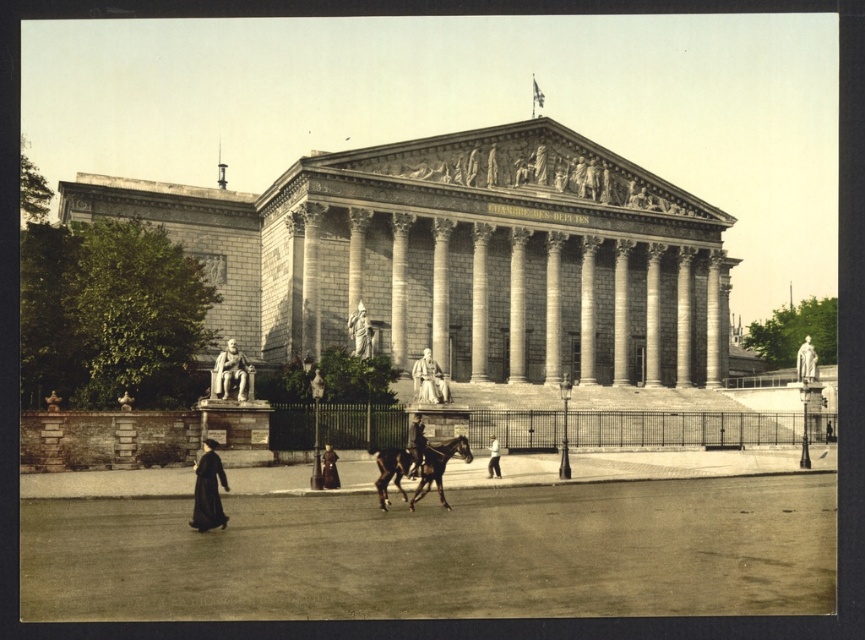
Which of these two, brown glossy horse at center or stone statue at left, stands shorter?

brown glossy horse at center

Who is higher up, brown glossy horse at center or stone statue at left?

stone statue at left is higher up.

Is point (407, 452) farther from camera compared to point (232, 378)?

That is False.

This screenshot has width=865, height=640. I want to click on brown glossy horse at center, so (x=417, y=467).

Does smooth stone statue at center have a smaller size compared to light beige fabric coat at center?

Yes.

Is smooth stone statue at center shorter than light beige fabric coat at center?

Yes.

This screenshot has width=865, height=640. What do you see at coordinates (428, 380) in the screenshot?
I see `smooth stone statue at center` at bounding box center [428, 380].

The width and height of the screenshot is (865, 640). I want to click on smooth stone statue at center, so click(x=428, y=380).

Does gray stone column at center come in front of smooth leather jacket at center?

No, gray stone column at center is further to the viewer.

The height and width of the screenshot is (640, 865). Describe the element at coordinates (587, 308) in the screenshot. I see `gray stone column at center` at that location.

Between point (590, 282) and point (407, 472), which one is positioned behind?

Point (590, 282)

Locate an element on the screen. gray stone column at center is located at coordinates (587, 308).